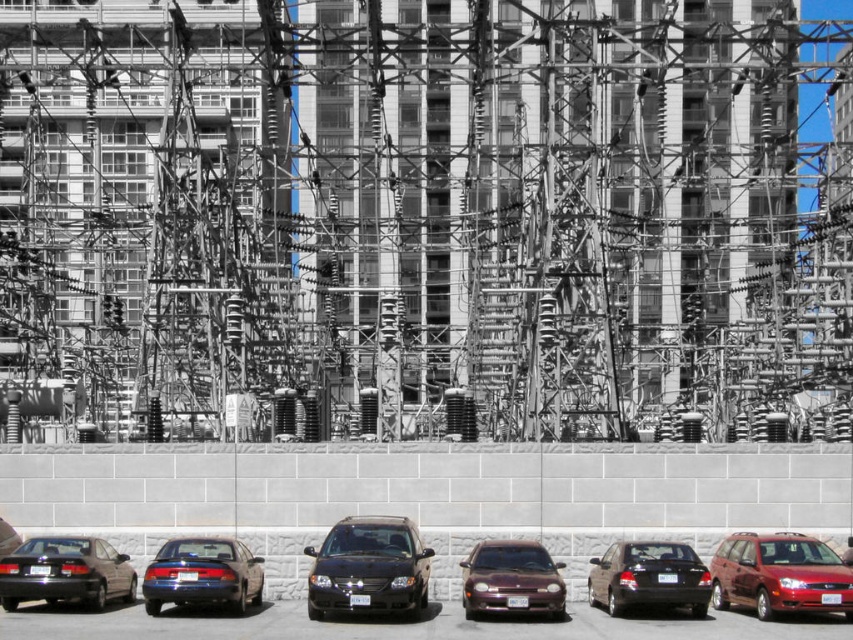
Question: Estimate the real-world distances between objects in this image. Which object is closer to the metallic scaffolding at center?

Choices:
 (A) shiny black sedan at lower center
 (B) shiny blue sedan at lower left

Answer: (A)

Question: Is matte black sedan at lower left below shiny blue sedan at lower left?

Choices:
 (A) yes
 (B) no

Answer: (B)

Question: Which point is closer to the camera?

Choices:
 (A) shiny blue sedan at lower left
 (B) metallic maroon sedan at center

Answer: (B)

Question: Considering the real-world distances, which object is closest to the shiny black sedan at lower center?

Choices:
 (A) shiny black van at center
 (B) metallic scaffolding at center
 (C) shiny blue sedan at lower left
 (D) shiny red van at lower right

Answer: (D)

Question: Is metallic scaffolding at center wider than shiny red van at lower right?

Choices:
 (A) no
 (B) yes

Answer: (B)

Question: From the image, what is the correct spatial relationship of shiny black van at center in relation to shiny blue sedan at lower left?

Choices:
 (A) below
 (B) above

Answer: (A)